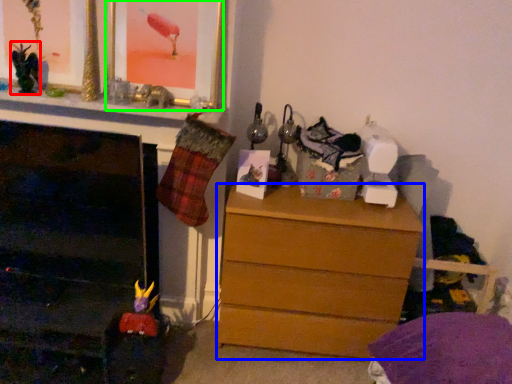
Question: Based on their relative distances, which object is nearer to toy (highlighted by a red box)? Choose from chest of drawers (highlighted by a blue box) and picture frame (highlighted by a green box).

Choices:
 (A) chest of drawers
 (B) picture frame

Answer: (B)